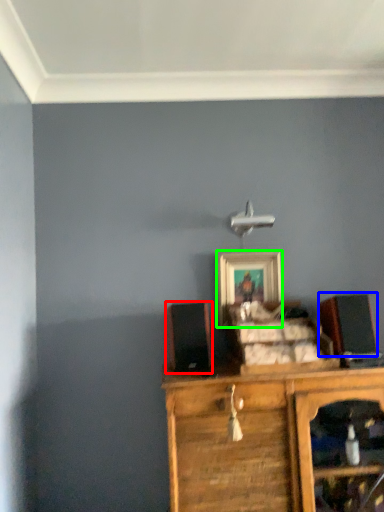
Question: Considering the real-world distances, which object is farthest from speaker (highlighted by a red box)? speaker (highlighted by a blue box) or picture frame (highlighted by a green box)?

Choices:
 (A) speaker
 (B) picture frame

Answer: (A)